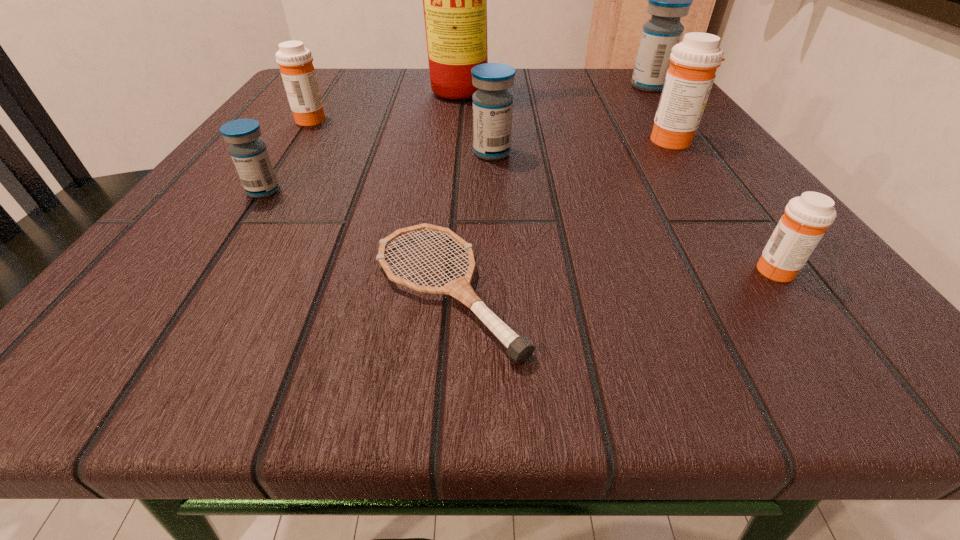
Locate an element on the screen. The height and width of the screenshot is (540, 960). blank area located 0.270m on the right of the sixth farthest object is located at coordinates (483, 191).

You are a GUI agent. You are given a task and a screenshot of the screen. Output one action in this format:
    pyautogui.click(x=<x>, y=<y>)
    Task: Click on the vacant space situated on the back of the nearest medicine
    
    Given the screenshot: What is the action you would take?
    pyautogui.click(x=723, y=196)

Locate an element on the screen. vacant space located on the back of the gray tennis racket is located at coordinates (458, 169).

This screenshot has height=540, width=960. Identify the location of fire extinguisher that is at the far edge. (454, 0).

Find the location of a particular element. object that is at the near edge is located at coordinates (519, 348).

This screenshot has width=960, height=540. I want to click on object at the far left corner, so click(x=295, y=61).

Find the location of `object at the far right corner`. object at the far right corner is located at coordinates (668, 0).

The image size is (960, 540). I want to click on free space at the far edge, so click(x=444, y=101).

Identify the location of vacant space at the near edge. Image resolution: width=960 pixels, height=540 pixels. (426, 308).

At what (x,y) coordinates should I click in order to perform the action: click on free space at the left edge of the desktop. Please return your answer as a coordinate pair (x, y). Looking at the image, I should click on (x=321, y=127).